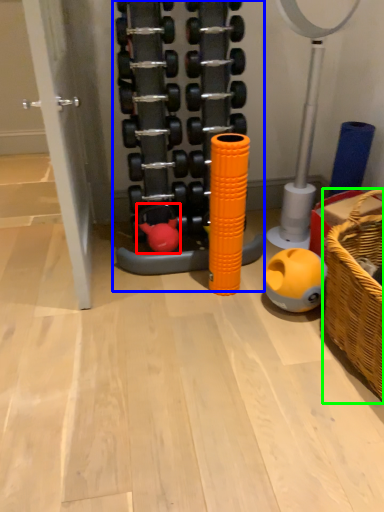
Question: Which object is positioned farthest from toy (highlighted by a red box)? Select from toy (highlighted by a blue box) and basket (highlighted by a green box).

Choices:
 (A) toy
 (B) basket

Answer: (B)